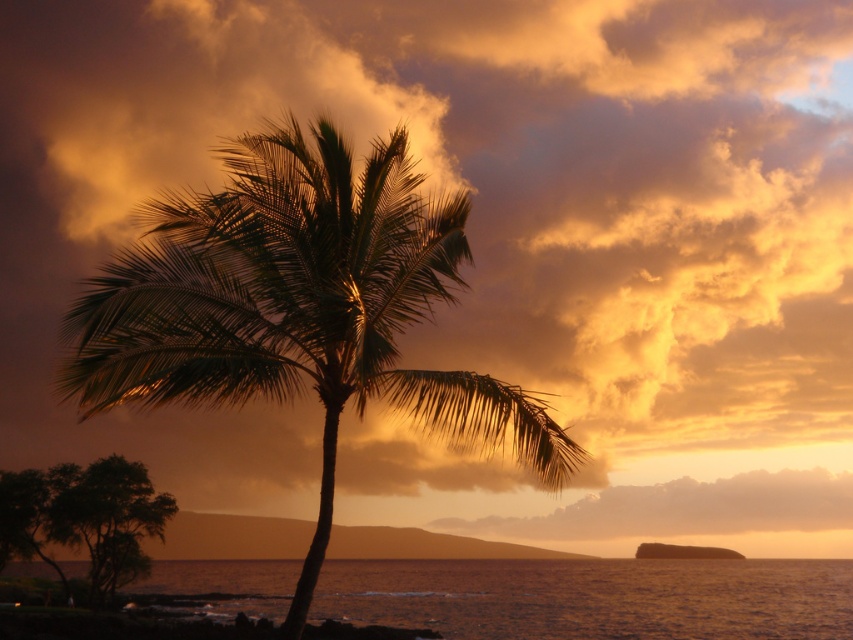
You are standing on the beach and see the green leafy palm tree at center and the smooth water at lower center. Which object is positioned closer to your left side?

The green leafy palm tree at center is positioned to the left of the smooth water at lower center, so it is closer to your left side.

You are a painter setting up your easel to capture this coastal sunset. You want to ensure the green leafy palm tree at center and the smooth water at lower center are proportionally accurate in your painting. Which object should you make thinner in your artwork?

The green leafy palm tree at center should be made thinner than the smooth water at lower center in the painting to maintain proportional accuracy.

You are standing at the point with coordinates (299,307) in the coastal scene. What object is exactly at your current location?

The green leafy palm tree at center is located at point (299,307), so the object at your current location is the green leafy palm tree at center.